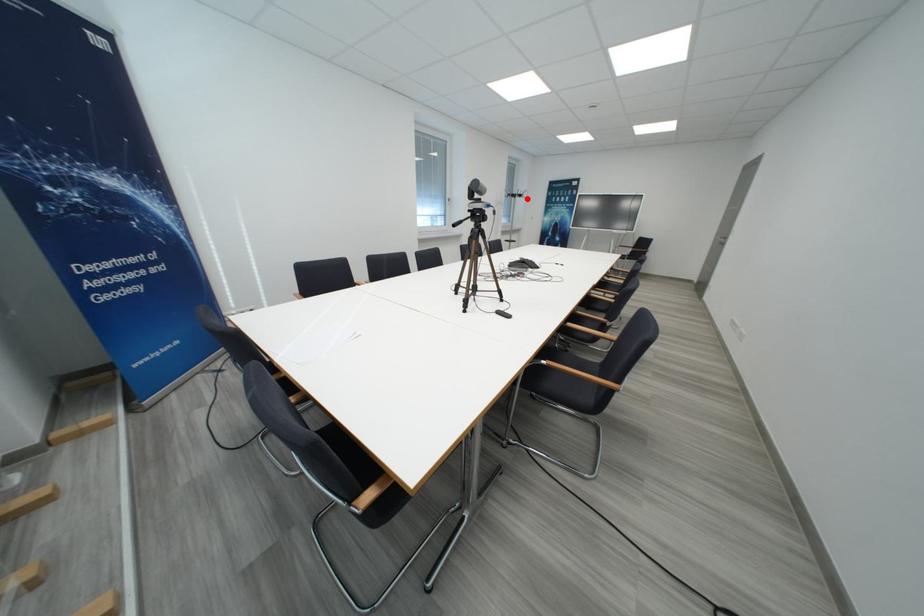
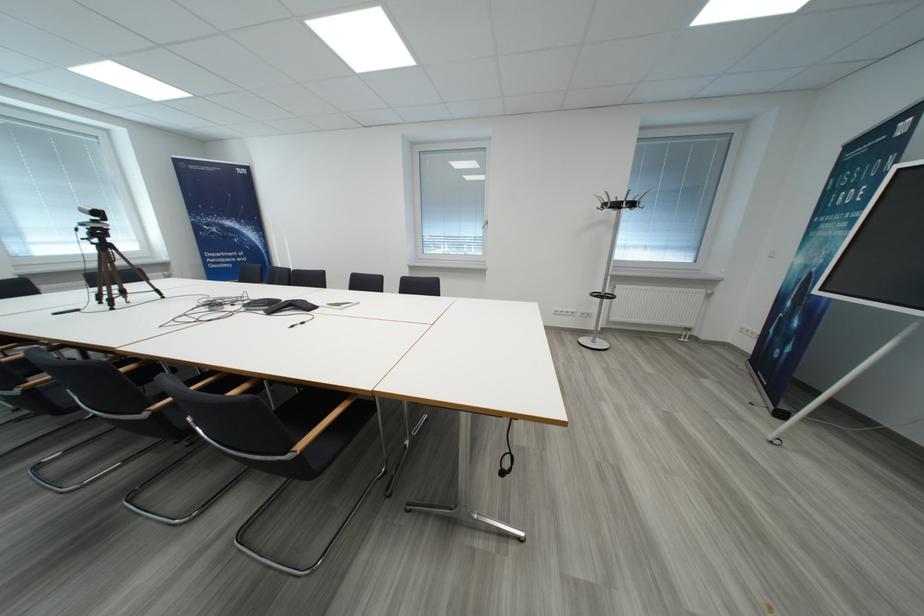
Find the pixel in the second image that matches the highlighted location in the first image.

(623, 208)